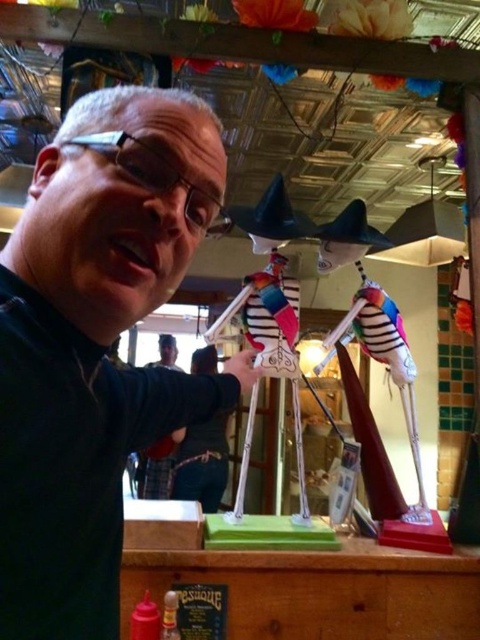
Question: Does black matte man at center have a smaller size compared to dark blue uniform at center?

Choices:
 (A) no
 (B) yes

Answer: (A)

Question: Which object is farther from the camera taking this photo?

Choices:
 (A) black matte man at center
 (B) dark blue uniform at center

Answer: (B)

Question: Does black matte man at center lie behind dark blue uniform at center?

Choices:
 (A) yes
 (B) no

Answer: (B)

Question: Among these objects, which one is nearest to the camera?

Choices:
 (A) black matte man at center
 (B) dark blue uniform at center

Answer: (A)

Question: Does black matte man at center lie in front of dark blue uniform at center?

Choices:
 (A) no
 (B) yes

Answer: (B)